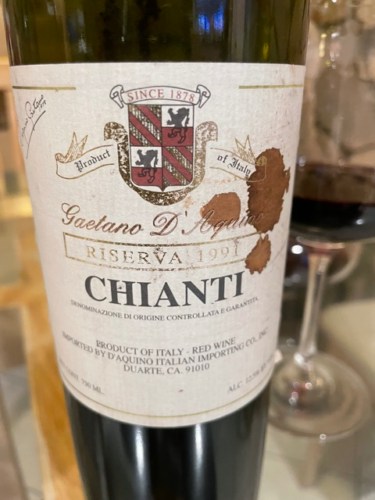
At what (x,y) coordinates should I click in order to perform the action: click on glass. Please return your answer as a coordinate pair (x, y). Looking at the image, I should click on (341, 206).